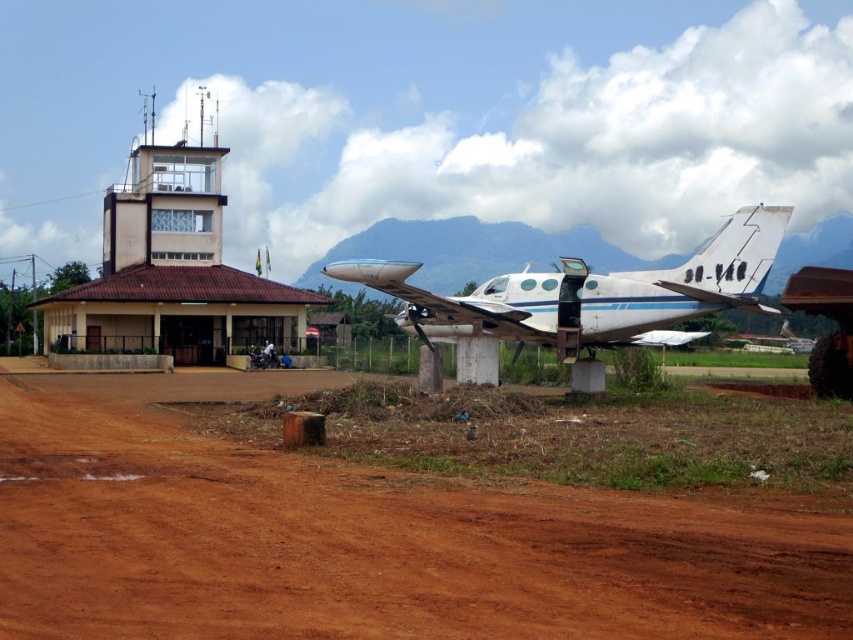
Find the location of a particular element. This screenshot has height=640, width=853. brown dirt field at lower center is located at coordinates (364, 538).

Is point (682, 620) closer to viewer compared to point (595, 333)?

Yes.

This screenshot has width=853, height=640. What are the coordinates of `brown dirt field at lower center` in the screenshot? It's located at (364, 538).